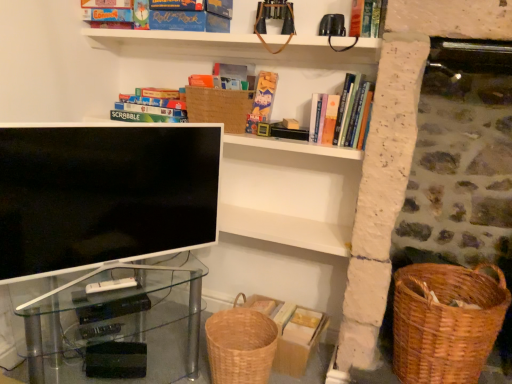
Question: Does transparent glass computer desk at lower left appear on the right side of woven brown basket at upper center?

Choices:
 (A) no
 (B) yes

Answer: (A)

Question: From a real-world perspective, is transparent glass computer desk at lower left located higher than woven brown basket at upper center?

Choices:
 (A) no
 (B) yes

Answer: (A)

Question: Does transparent glass computer desk at lower left have a lesser height compared to woven brown basket at upper center?

Choices:
 (A) yes
 (B) no

Answer: (B)

Question: Can you confirm if transparent glass computer desk at lower left is taller than woven brown basket at upper center?

Choices:
 (A) yes
 (B) no

Answer: (A)

Question: Is transparent glass computer desk at lower left looking in the opposite direction of woven brown basket at upper center?

Choices:
 (A) yes
 (B) no

Answer: (B)

Question: In the image, is hardcover book at upper right, marked as the second book in a right-to-left arrangement, on the left side or the right side of matte cardboard book at upper center, the second book in the left-to-right sequence?

Choices:
 (A) right
 (B) left

Answer: (A)

Question: Do you think hardcover book at upper right, marked as the 3th book in a left-to-right arrangement, is within matte cardboard book at upper center, the second book in the left-to-right sequence, or outside of it?

Choices:
 (A) inside
 (B) outside

Answer: (B)

Question: Is hardcover book at upper right, marked as the second book in a right-to-left arrangement, wider or thinner than matte cardboard book at upper center, the second book in the left-to-right sequence?

Choices:
 (A) wide
 (B) thin

Answer: (A)

Question: Does point (357, 89) appear closer or farther from the camera than point (266, 86)?

Choices:
 (A) farther
 (B) closer

Answer: (B)

Question: Considering the positions of matte cardboard scrabble board game at upper left, which is the fourth book from right to left, and woven brown basket at upper center in the image, is matte cardboard scrabble board game at upper left, which is the fourth book from right to left, bigger or smaller than woven brown basket at upper center?

Choices:
 (A) small
 (B) big

Answer: (A)

Question: In terms of width, does matte cardboard scrabble board game at upper left, which is the first book from left to right, look wider or thinner when compared to woven brown basket at upper center?

Choices:
 (A) wide
 (B) thin

Answer: (A)

Question: From a real-world perspective, is matte cardboard scrabble board game at upper left, which is the fourth book from right to left, positioned above or below woven brown basket at upper center?

Choices:
 (A) below
 (B) above

Answer: (A)

Question: Would you say matte cardboard scrabble board game at upper left, which is the first book from left to right, is to the left or to the right of woven brown basket at upper center in the picture?

Choices:
 (A) right
 (B) left

Answer: (B)

Question: From a real-world perspective, is woven brown basket at lower center, arranged as the 2th basket container when viewed from the right, physically located above or below matte cardboard book at upper center, positioned as the third book in right-to-left order?

Choices:
 (A) below
 (B) above

Answer: (A)

Question: Is woven brown basket at lower center, arranged as the 2th basket container when viewed from the right, wider or thinner than matte cardboard book at upper center, positioned as the third book in right-to-left order?

Choices:
 (A) thin
 (B) wide

Answer: (B)